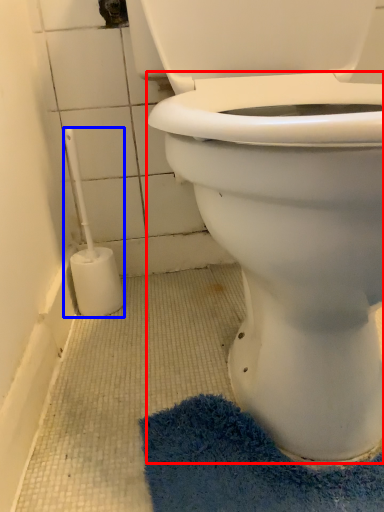
Question: Which object appears closest to the camera in this image, bidet (highlighted by a red box) or brush (highlighted by a blue box)?

Choices:
 (A) bidet
 (B) brush

Answer: (A)